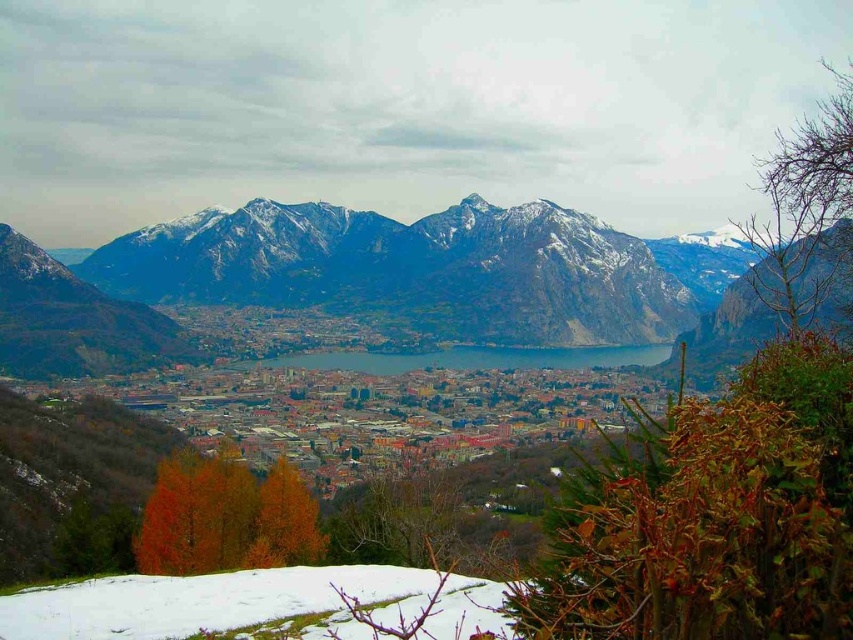
Question: Estimate the real-world distances between objects in this image. Which object is closer to the snowy rock mountain range at upper center?

Choices:
 (A) blue glass lake at center
 (B) white fluffy snow at lower left

Answer: (A)

Question: In this image, where is snowy rock mountain range at upper center located relative to blue glass lake at center?

Choices:
 (A) above
 (B) below

Answer: (A)

Question: Can you confirm if snowy rock mountain range at upper center is wider than blue glass lake at center?

Choices:
 (A) yes
 (B) no

Answer: (A)

Question: Which point is closer to the camera taking this photo?

Choices:
 (A) (509, 628)
 (B) (553, 352)
 (C) (119, 328)

Answer: (A)

Question: Which object is positioned farthest from the snowy rock mountain range at upper center?

Choices:
 (A) white fluffy snow at lower left
 (B) blue glass lake at center

Answer: (A)

Question: Is snowy rock mountain range at upper center smaller than white fluffy snow at lower left?

Choices:
 (A) yes
 (B) no

Answer: (B)